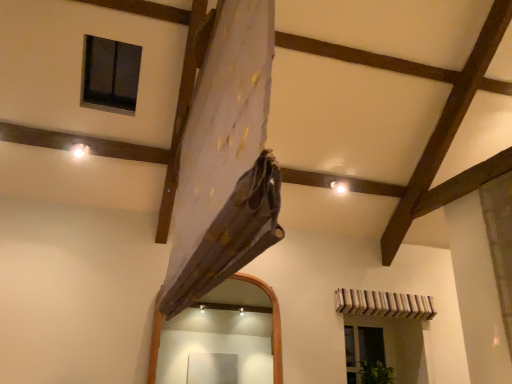
Question: Should I look upward or downward to see clear glass window at lower right?

Choices:
 (A) up
 (B) down

Answer: (B)